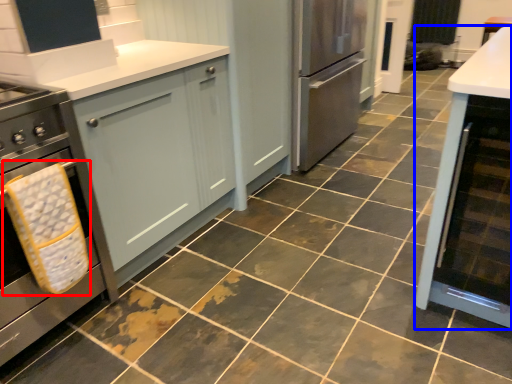
Question: Which object is closer to the camera taking this photo, material (highlighted by a red box) or cabinetry (highlighted by a blue box)?

Choices:
 (A) material
 (B) cabinetry

Answer: (B)